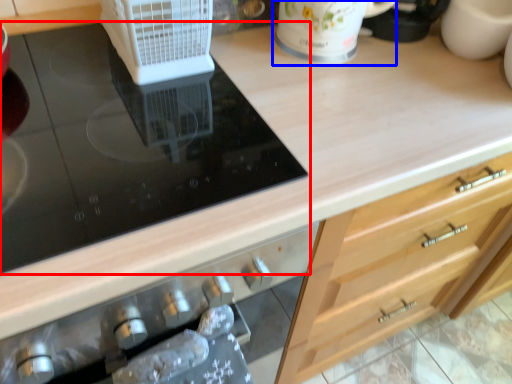
Question: Which object is closer to the camera taking this photo, gas stove (highlighted by a red box) or mug (highlighted by a blue box)?

Choices:
 (A) gas stove
 (B) mug

Answer: (A)